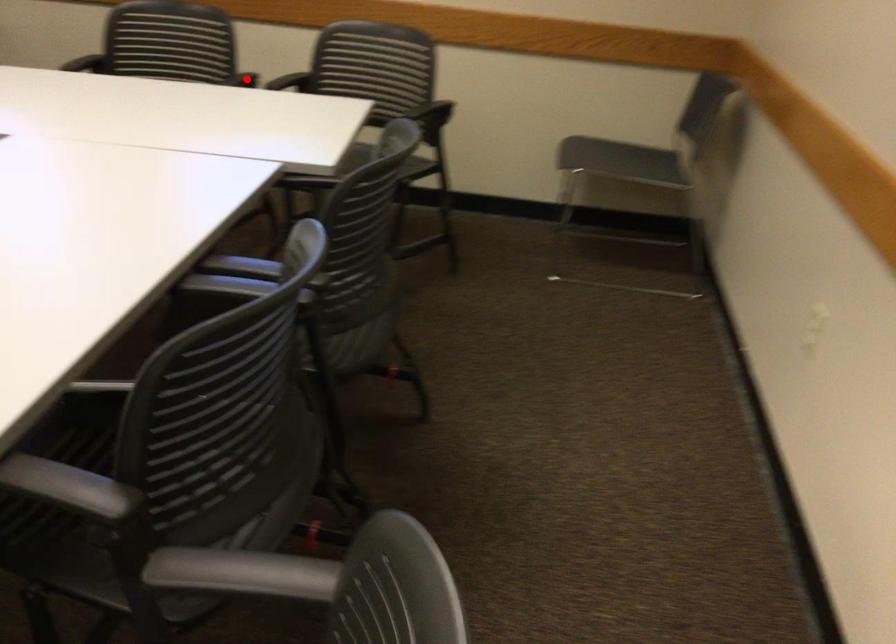
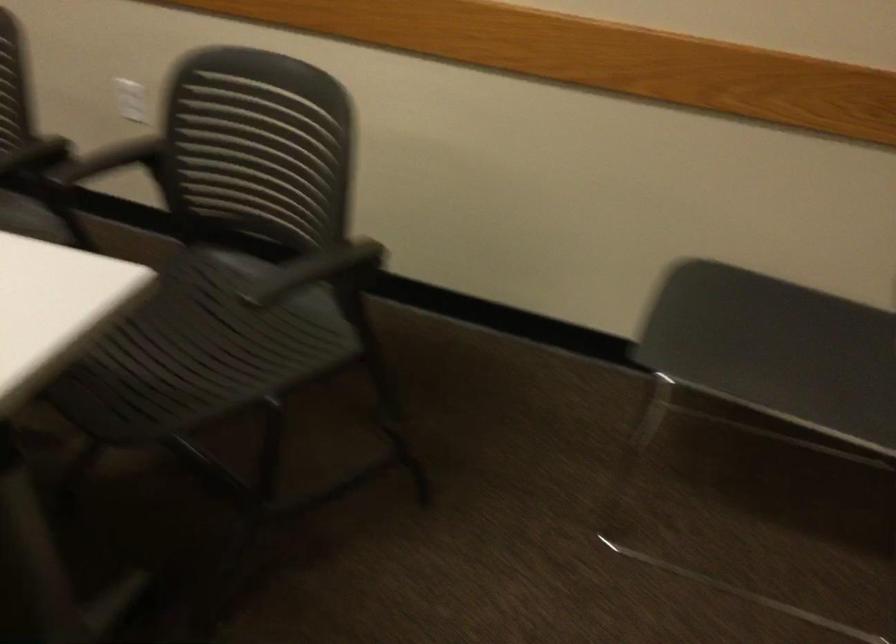
Question: A red point is marked in image1. In image2, is the corresponding 3D point closer to the camera or farther? Reply with the corresponding letter.

Choices:
 (A) The corresponding 3D point is closer.
 (B) The corresponding 3D point is farther.

Answer: (A)